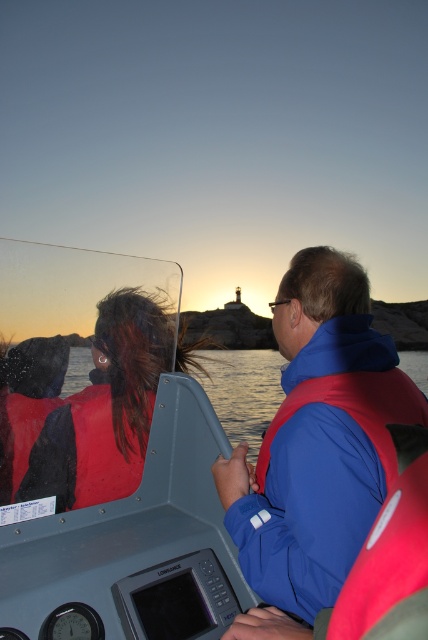
Which is more to the left, blue fabric life vest at right or transparent water at center?

blue fabric life vest at right

Does point (362, 451) come in front of point (415, 380)?

Yes, it is.

Who is more distant from viewer, (374, 378) or (264, 355)?

Point (264, 355)

Where is `blue fabric life vest at right`? The image size is (428, 640). blue fabric life vest at right is located at coordinates (318, 438).

Is rubberized red life vest at center below blue fabric life vest at right?

No.

In the scene shown: How distant is rubberized red life vest at center from blue fabric life vest at right?

rubberized red life vest at center is 6.56 inches away from blue fabric life vest at right.

Measure the distance between point (374, 364) and camera.

They are 6.05 feet apart.

The height and width of the screenshot is (640, 428). Find the location of `rubberized red life vest at center`. rubberized red life vest at center is located at coordinates (208, 476).

Based on the photo, which is more to the left, rubberized red life vest at center or transparent water at center?

Positioned to the left is rubberized red life vest at center.

Can you confirm if rubberized red life vest at center is positioned above transparent water at center?

Indeed, rubberized red life vest at center is positioned over transparent water at center.

Does point (324, 374) lie behind point (276, 404)?

That is False.

Find the location of a particular element. This screenshot has width=428, height=640. rubberized red life vest at center is located at coordinates (208, 476).